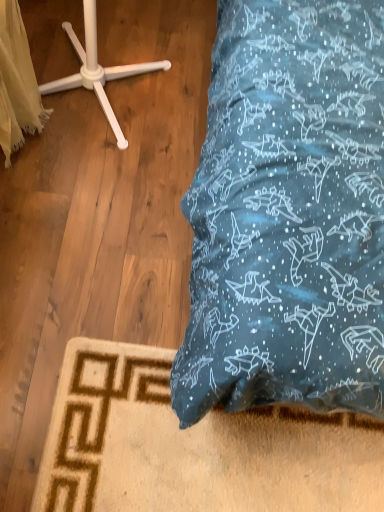
Question: Can you confirm if white fabric at left is positioned to the left of white plastic coat stand at upper left?

Choices:
 (A) no
 (B) yes

Answer: (B)

Question: Does white fabric at left have a greater height compared to white plastic coat stand at upper left?

Choices:
 (A) yes
 (B) no

Answer: (A)

Question: From the image's perspective, does white fabric at left appear higher than white plastic coat stand at upper left?

Choices:
 (A) no
 (B) yes

Answer: (A)

Question: Considering the relative sizes of white fabric at left and white plastic coat stand at upper left in the image provided, is white fabric at left thinner than white plastic coat stand at upper left?

Choices:
 (A) no
 (B) yes

Answer: (B)

Question: Is white plastic coat stand at upper left surrounded by white fabric at left?

Choices:
 (A) yes
 (B) no

Answer: (B)

Question: Does white fabric at left lie behind white plastic coat stand at upper left?

Choices:
 (A) no
 (B) yes

Answer: (A)

Question: Could white fabric at left be considered to be inside white plastic coat stand at upper left?

Choices:
 (A) no
 (B) yes

Answer: (A)

Question: Is white plastic coat stand at upper left oriented away from white fabric at left?

Choices:
 (A) no
 (B) yes

Answer: (A)

Question: From a real-world perspective, is white plastic coat stand at upper left beneath white fabric at left?

Choices:
 (A) yes
 (B) no

Answer: (A)

Question: Does white plastic coat stand at upper left lie in front of white fabric at left?

Choices:
 (A) no
 (B) yes

Answer: (A)

Question: Is white plastic coat stand at upper left far from white fabric at left?

Choices:
 (A) no
 (B) yes

Answer: (A)

Question: Is the depth of white plastic coat stand at upper left greater than that of white fabric at left?

Choices:
 (A) yes
 (B) no

Answer: (A)

Question: Is white fabric at left in front of or behind white plastic coat stand at upper left in the image?

Choices:
 (A) front
 (B) behind

Answer: (A)